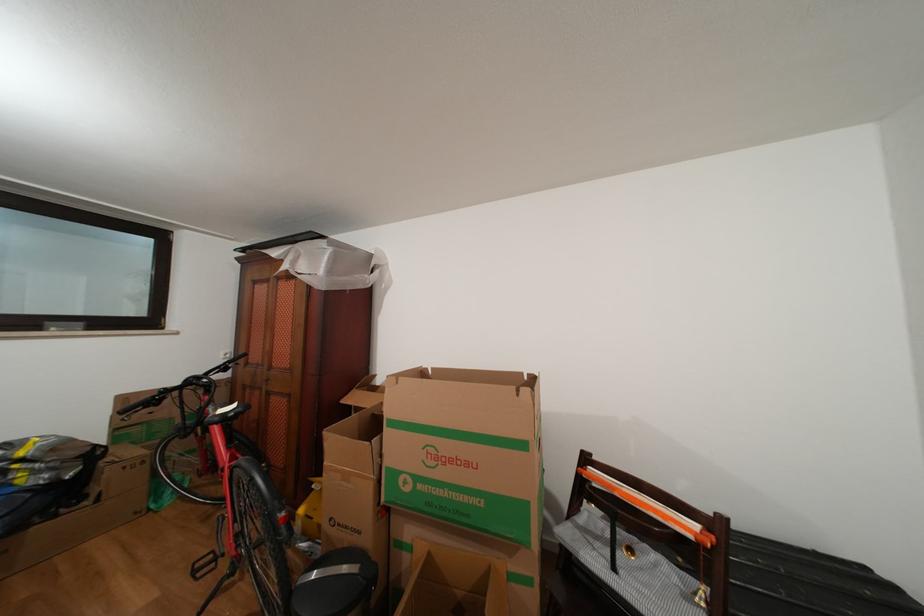
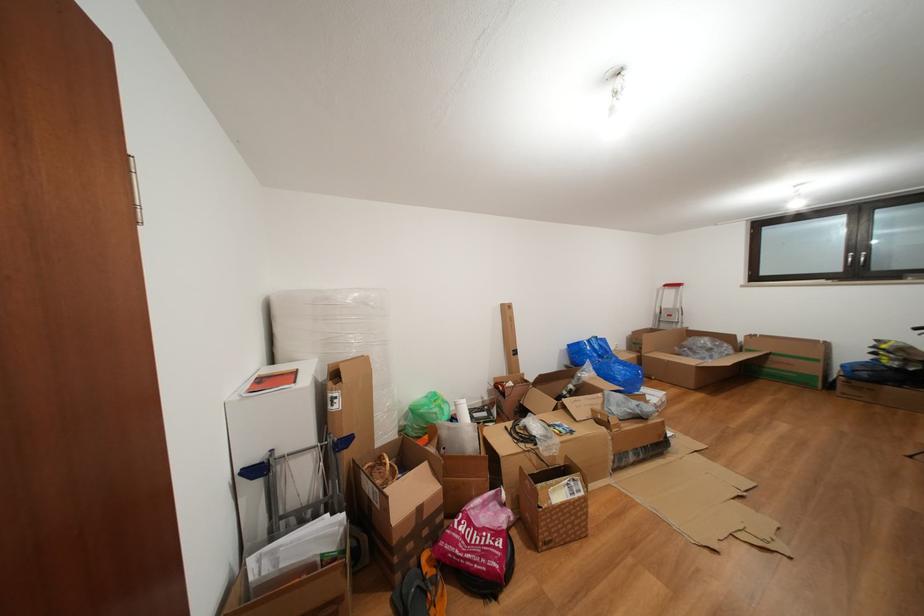
The point at (x=27, y=533) is marked in the first image. Where is the corresponding point in the second image?

(886, 387)